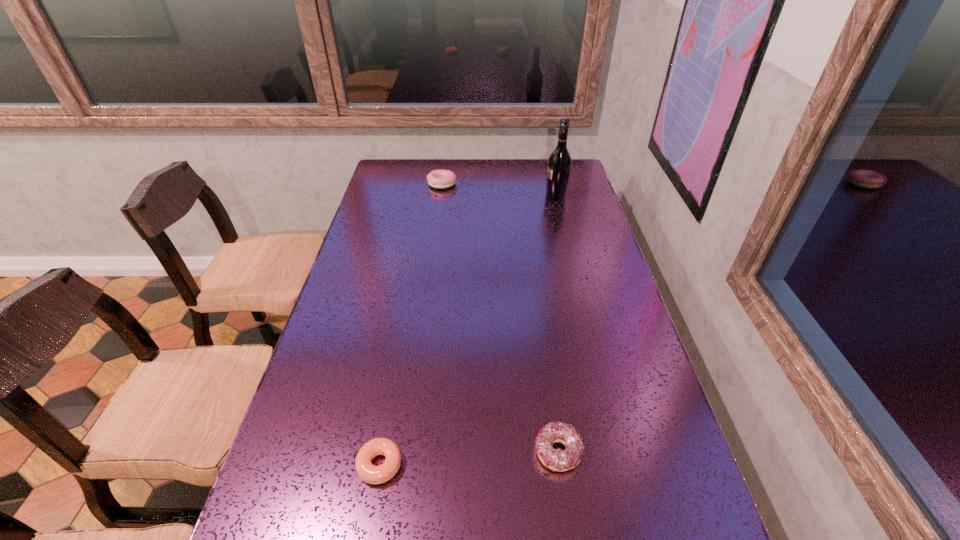
The height and width of the screenshot is (540, 960). I want to click on free space between the rightmost doughnut and the farthest object, so click(x=500, y=318).

At what (x,y) coordinates should I click in order to perform the action: click on vacant space that is in between the wine bottle and the shortest doughnut. Please return your answer as a coordinate pair (x, y). Looking at the image, I should click on (468, 331).

Where is `vacant point located between the shortest doughnut and the rightmost object`? The height and width of the screenshot is (540, 960). vacant point located between the shortest doughnut and the rightmost object is located at coordinates (468, 331).

Select which object is the second closest to the tallest object. Please provide its 2D coordinates. Your answer should be formatted as a tuple, i.e. [(x, y)], where the tuple contains the x and y coordinates of a point satisfying the conditions above.

[(560, 460)]

Identify the location of object that is the second closest to the farthest object. The width and height of the screenshot is (960, 540). (560, 460).

Identify the location of doughnut that stands as the closest to the shortest doughnut. (560, 460).

The image size is (960, 540). I want to click on doughnut that is the second nearest to the shortest object, so click(440, 179).

Locate an element on the screen. blank space that satisfies the following two spatial constraints: 1. on the back side of the shortest object; 2. on the left side of the farthest doughnut is located at coordinates (429, 184).